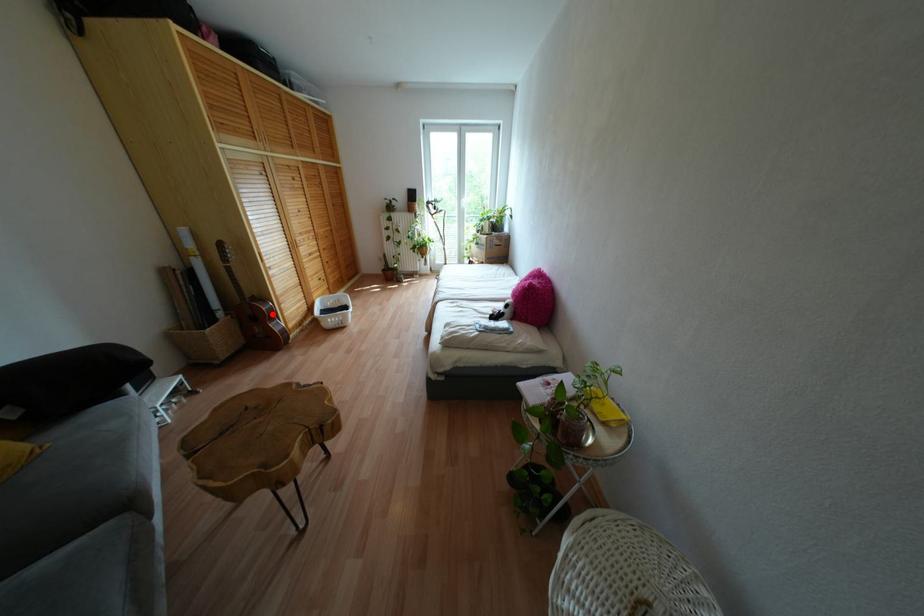
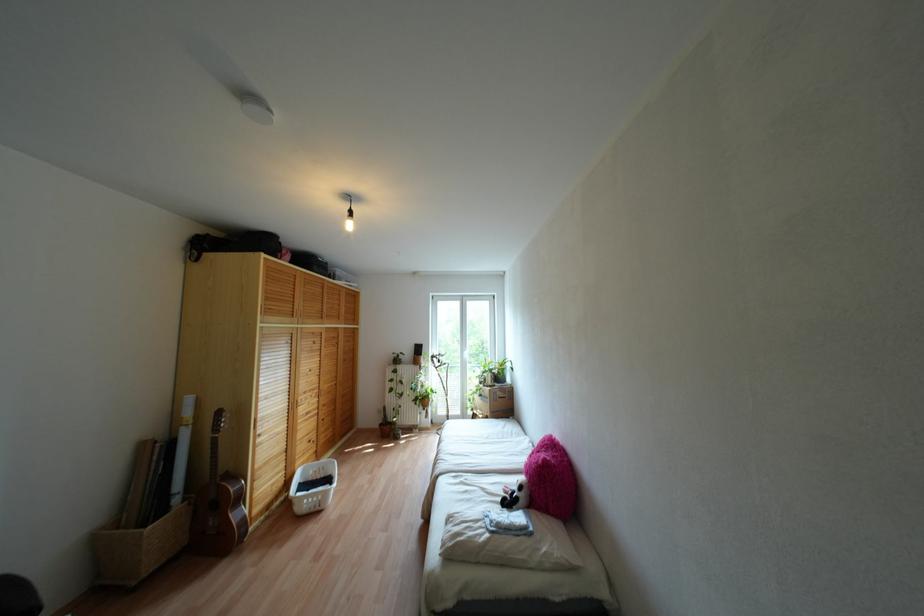
In the second image, find the point that corresponds to the highlighted location in the first image.

(238, 498)